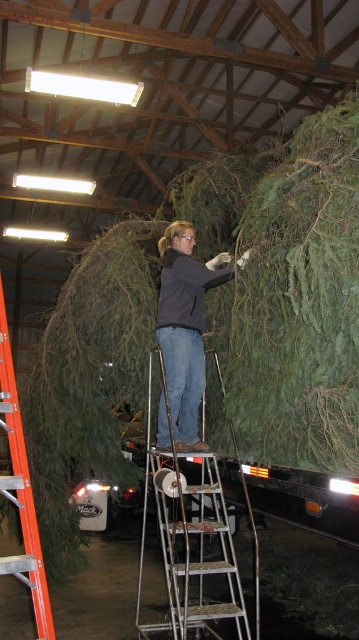
You are a painter needing to choose a ladder to reach a high beam in the barn. Both the silver metallic ladder at center and the orange plastic ladder at left are available. Which ladder should you choose based on their sizes?

The silver metallic ladder at center has a larger size compared to the orange plastic ladder at left, so you should choose the silver metallic ladder at center to reach the high beam in the barn.

You are a delivery person who needs to climb the silver metallic ladder at center to secure the tree. Can you safely climb it if your height is 1.7 meters?

The silver metallic ladder at center is 3.42 meters from viewer. Since the ladder is 3.42 meters away and your height is 1.7 meters, you can safely climb it as the distance does not affect your ability to reach or climb the ladder itself.

You are standing at the camera position and want to pick up an object located at point (203, 323). If your reach is 15 feet, can you grab it without moving?

The point (203, 323) is 16.19 feet away from the camera, which is beyond your 15 feet reach. You cannot grab it without moving closer.